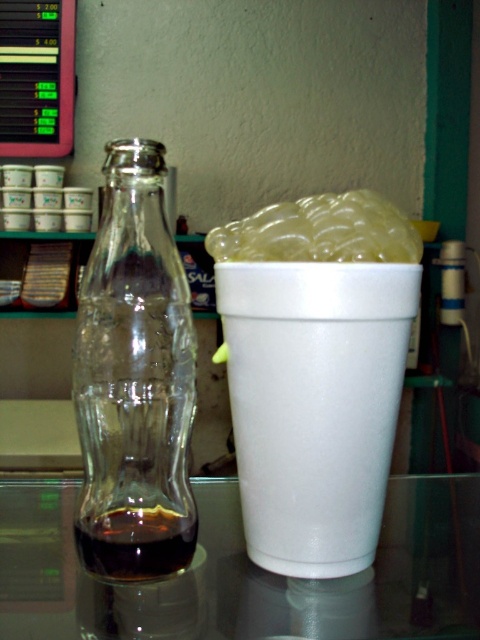
Question: Where is translucent gelatinous substance at upper center located in relation to dark brown liquid at bottle left in the image?

Choices:
 (A) below
 (B) above

Answer: (B)

Question: Which is nearer to the dark brown liquid at bottle left?

Choices:
 (A) transparent glass table at center
 (B) transparent glass bottle at left

Answer: (B)

Question: Does transparent glass bottle at left have a smaller size compared to dark brown liquid at bottle left?

Choices:
 (A) yes
 (B) no

Answer: (B)

Question: Estimate the real-world distances between objects in this image. Which object is closer to the transparent glass bottle at left?

Choices:
 (A) transparent glass table at center
 (B) dark brown liquid at bottle left

Answer: (B)

Question: Which object is the farthest from the transparent glass bottle at left?

Choices:
 (A) dark brown liquid at bottle left
 (B) transparent glass table at center

Answer: (B)

Question: In this image, where is transparent glass table at center located relative to dark brown liquid at bottle left?

Choices:
 (A) right
 (B) left

Answer: (A)